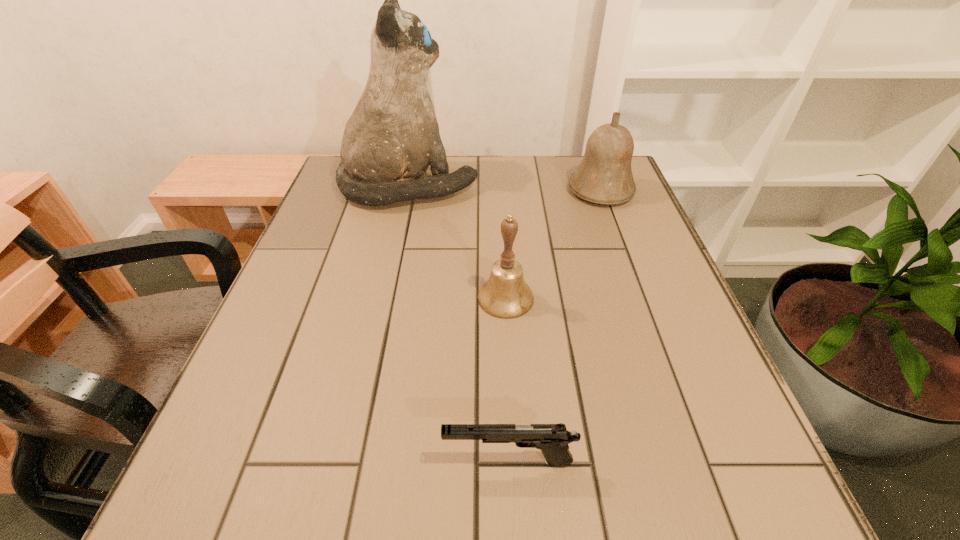
In order to click on cat in this screenshot , I will do `click(391, 138)`.

In order to click on the rightmost object in this screenshot , I will do `click(604, 176)`.

You are a GUI agent. You are given a task and a screenshot of the screen. Output one action in this format:
    pyautogui.click(x=<x>, y=<y>)
    Task: Click on the farther bell
    
    Given the screenshot: What is the action you would take?
    pyautogui.click(x=604, y=176)

At what (x,y) coordinates should I click in order to perform the action: click on the third farthest object. Please return your answer as a coordinate pair (x, y). This screenshot has height=540, width=960. Looking at the image, I should click on (505, 295).

Find the location of a particular element. the left bell is located at coordinates (505, 295).

This screenshot has height=540, width=960. What are the coordinates of `gun` in the screenshot? It's located at (552, 439).

Where is `the nearest object`? The width and height of the screenshot is (960, 540). the nearest object is located at coordinates (552, 439).

Identify the location of vacant space located at the face of the tallest object. (622, 185).

This screenshot has width=960, height=540. In order to click on free space located 0.210m on the front of the right bell in this screenshot , I will do `click(628, 262)`.

Locate an element on the screen. vacant area situated on the front of the left bell is located at coordinates (516, 467).